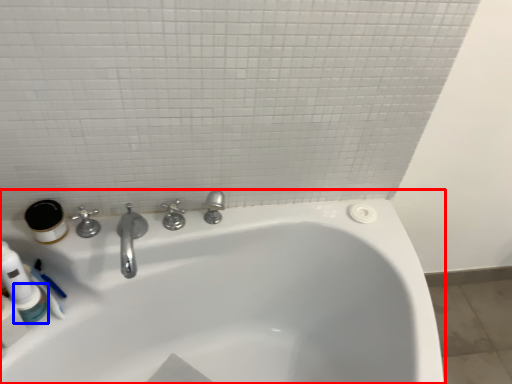
Question: Which object is closer to the camera taking this photo, bathtub (highlighted by a red box) or mouthwash (highlighted by a blue box)?

Choices:
 (A) bathtub
 (B) mouthwash

Answer: (A)